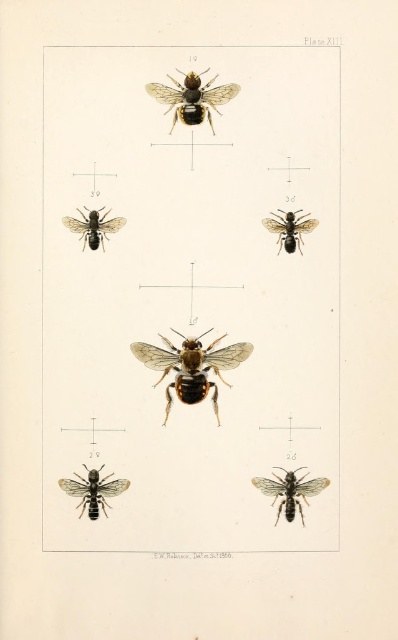
Question: Does black matte wasp at upper right have a greater width compared to matte black wasp at upper left?

Choices:
 (A) no
 (B) yes

Answer: (A)

Question: Based on their relative distances, which object is farther from the black matte wasp at lower right?

Choices:
 (A) black matte bee at lower left
 (B) matte black wasp at upper left
 (C) black matte bee at upper center

Answer: (C)

Question: Does shiny brown wasp at center appear on the right side of black matte wasp at lower right?

Choices:
 (A) yes
 (B) no

Answer: (B)

Question: Which object is closer to the camera taking this photo?

Choices:
 (A) shiny brown wasp at center
 (B) black matte bee at upper center
 (C) matte black wasp at upper left
 (D) black matte bee at lower left

Answer: (B)

Question: Does black matte wasp at lower right have a larger size compared to black matte bee at lower left?

Choices:
 (A) yes
 (B) no

Answer: (A)

Question: Among these points, which one is nearest to the camera?

Choices:
 (A) pos(296,244)
 (B) pos(105,504)
 (C) pos(99,230)

Answer: (B)